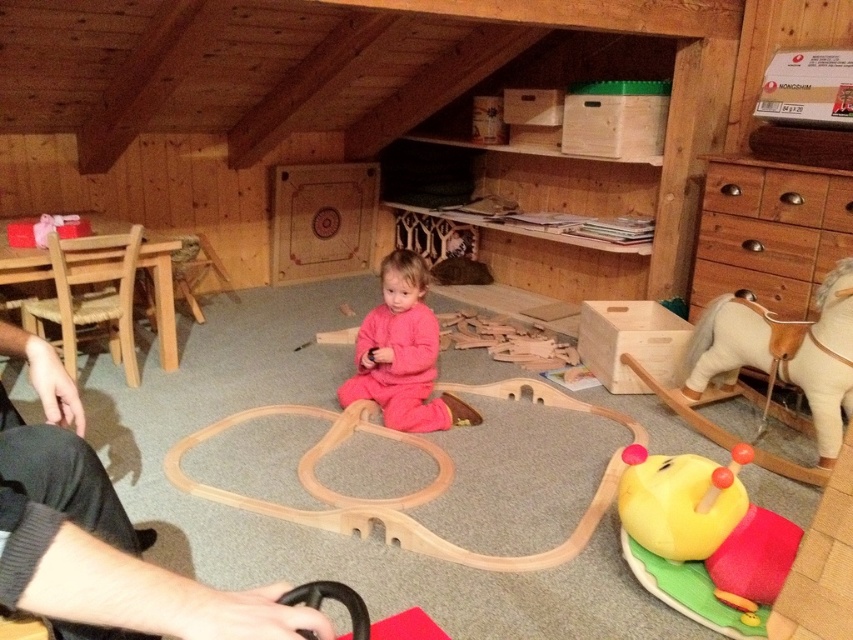
You are a parent in the room and want to place a small potted plant on the floor. The potted plant has a diameter of 30 cm. The point at coordinate (x=102, y=538) is 40 cm away from the nearest wall. Is there enough space to place the potted plant there?

The point at coordinate (x=102, y=538) is 40 cm away from the nearest wall, and the potted plant has a diameter of 30 cm. Since 30 cm is less than 40 cm, there is enough space to place the potted plant there.

You are a parent trying to place a small toy between the two points, point [767,220] and point [383,422]. Which point is closer to you so you can place the toy there first?

Point [767,220] is further to the viewer than point [383,422], so the closer point to you is point [383,422]. Place the toy near point [383,422] first.

From the picture: You are a parent trying to put away a black fabric at lower left after playtime. Where in the room should you place it so it doesn not obstruct the child playing with the wooden toy train set?

The black fabric at lower left is located at point (102, 538), so you should place it away from the area where the child is playing with the wooden toy train set to avoid obstruction.